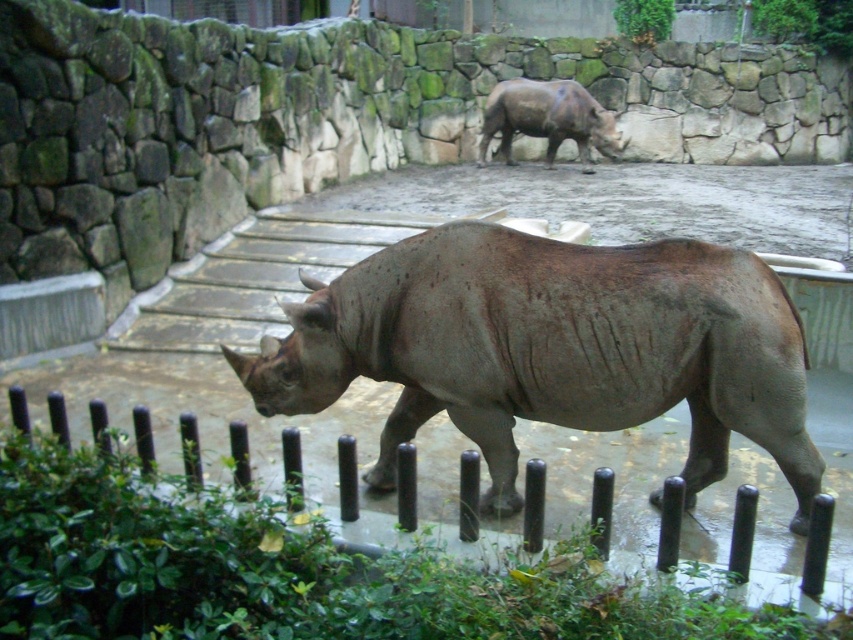
Question: Does black plastic fence at lower center lie behind grayish-brown textured rhinoceros at upper center?

Choices:
 (A) yes
 (B) no

Answer: (B)

Question: Which point is farther from the camera taking this photo?

Choices:
 (A) (605, 282)
 (B) (582, 88)

Answer: (B)

Question: In this image, where is grayish-brown textured rhinoceros at center located relative to black plastic fence at lower center?

Choices:
 (A) below
 (B) above

Answer: (B)

Question: Considering the real-world distances, which object is closest to the grayish-brown textured rhinoceros at upper center?

Choices:
 (A) black plastic fence at lower center
 (B) grayish-brown textured rhinoceros at center

Answer: (B)

Question: Among these objects, which one is farthest from the camera?

Choices:
 (A) black plastic fence at lower center
 (B) grayish-brown textured rhinoceros at upper center
 (C) grayish-brown textured rhinoceros at center

Answer: (B)

Question: Does grayish-brown textured rhinoceros at center appear under black plastic fence at lower center?

Choices:
 (A) no
 (B) yes

Answer: (A)